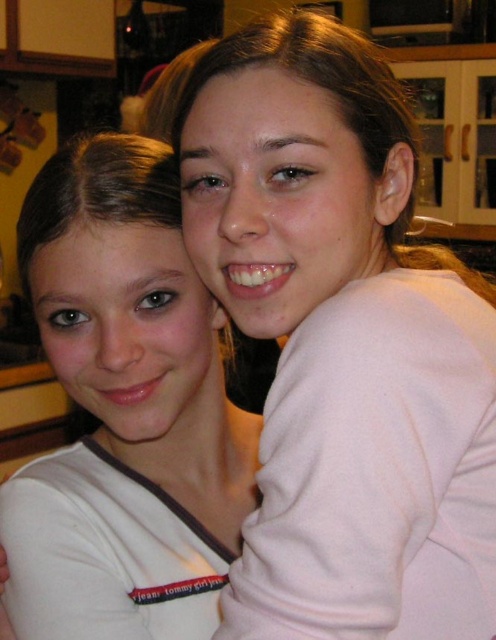
Is pink matte sweater at upper right thinner than white matte shirt at center?

In fact, pink matte sweater at upper right might be wider than white matte shirt at center.

In the scene shown: Who is lower down, pink matte sweater at upper right or white matte shirt at center?

white matte shirt at center is lower down.

This screenshot has height=640, width=496. Identify the location of pink matte sweater at upper right. (343, 342).

The height and width of the screenshot is (640, 496). Identify the location of pink matte sweater at upper right. (343, 342).